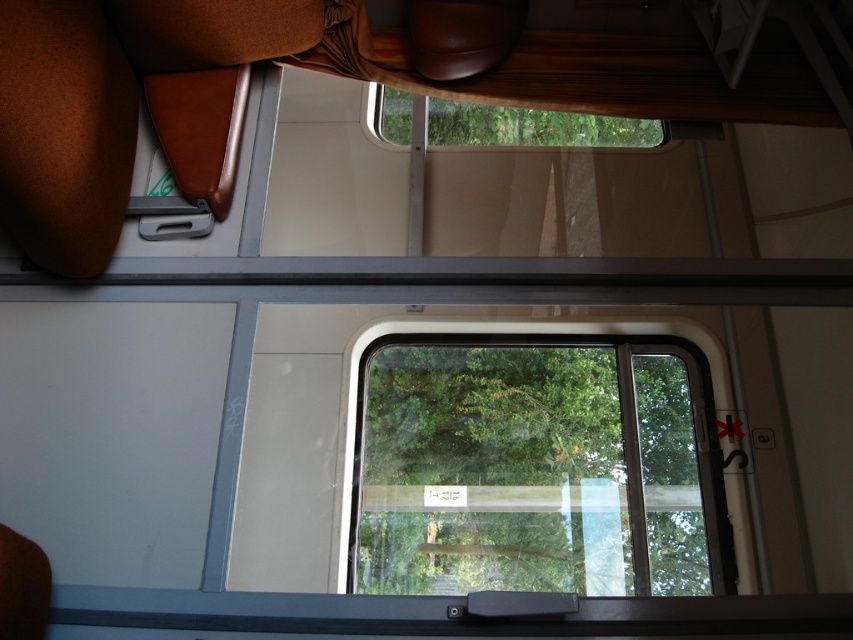
Based on the photo, is transparent glass window at center above transparent glass window at upper center?

Incorrect, transparent glass window at center is not positioned above transparent glass window at upper center.

Who is positioned more to the right, transparent glass window at center or transparent glass window at upper center?

From the viewer's perspective, transparent glass window at center appears more on the right side.

At what (x,y) coordinates should I click in order to perform the action: click on transparent glass window at center. Please return your answer as a coordinate pair (x, y). This screenshot has width=853, height=640. Looking at the image, I should click on (537, 468).

Image resolution: width=853 pixels, height=640 pixels. Identify the location of transparent glass window at center. (537, 468).